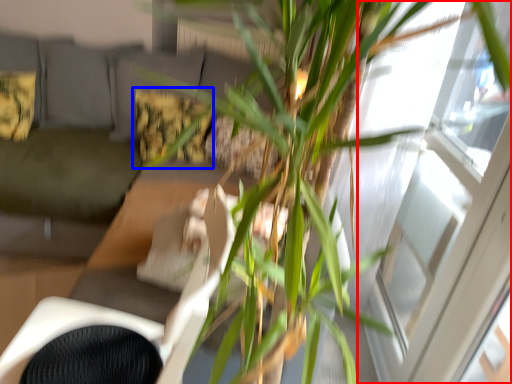
Question: Which object appears farthest to the camera in this image, window (highlighted by a red box) or pillow (highlighted by a blue box)?

Choices:
 (A) window
 (B) pillow

Answer: (B)